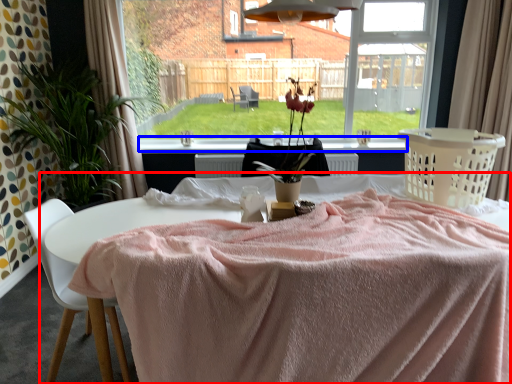
Question: Which object is further to the camera taking this photo, table (highlighted by a red box) or window sill (highlighted by a blue box)?

Choices:
 (A) table
 (B) window sill

Answer: (B)